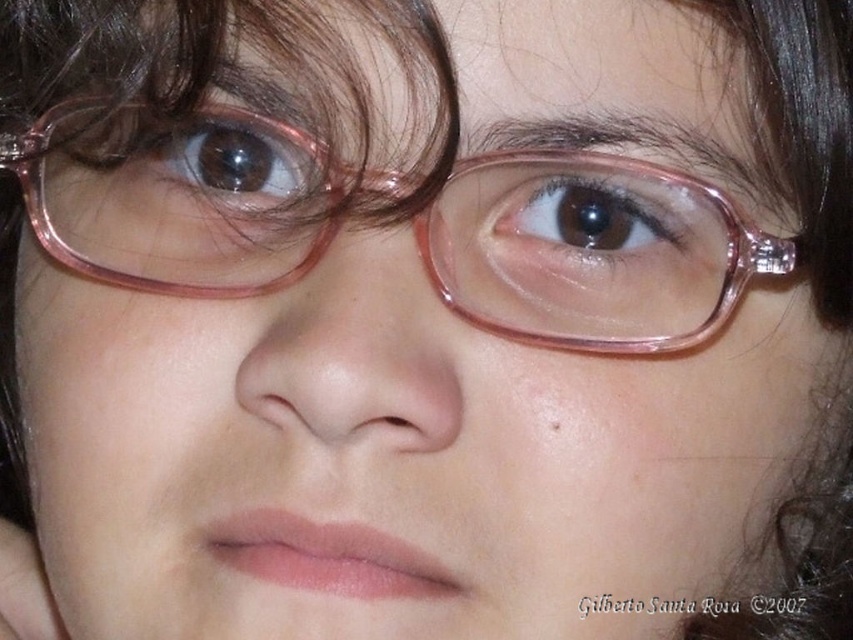
Question: Observing the image, what is the correct spatial positioning of transparent plastic glasses at center in reference to brown glossy eye at center?

Choices:
 (A) above
 (B) below

Answer: (B)

Question: Can you confirm if transparent plastic glasses at center is positioned below brown glossy eye at center?

Choices:
 (A) yes
 (B) no

Answer: (A)

Question: Which point is closer to the camera?

Choices:
 (A) transparent plastic glasses at center
 (B) brown glossy eye at center

Answer: (A)

Question: Among these points, which one is nearest to the camera?

Choices:
 (A) (519, 264)
 (B) (270, 150)
 (C) (627, 216)

Answer: (A)

Question: Does transparent plastic glasses at center appear over brownsmootheye at upper center?

Choices:
 (A) yes
 (B) no

Answer: (B)

Question: Which object is positioned farthest from the brown glossy eye at center?

Choices:
 (A) brownsmootheye at upper center
 (B) transparent plastic glasses at center

Answer: (A)